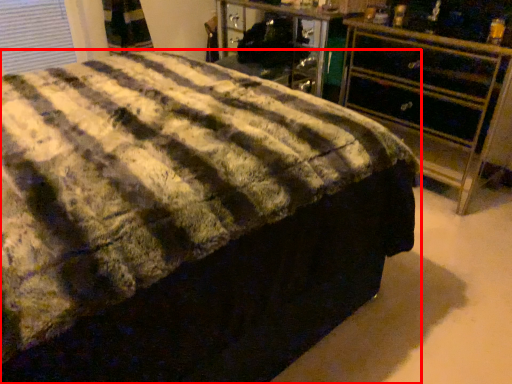
Question: From the image, what is the correct spatial relationship of bed (annotated by the red box) in relation to chest of drawers?

Choices:
 (A) right
 (B) left

Answer: (B)